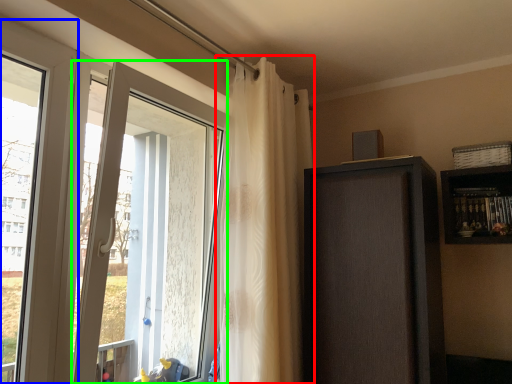
Question: Considering the real-world distances, which object is farthest from curtain (highlighted by a red box)? window (highlighted by a blue box) or door (highlighted by a green box)?

Choices:
 (A) window
 (B) door

Answer: (A)